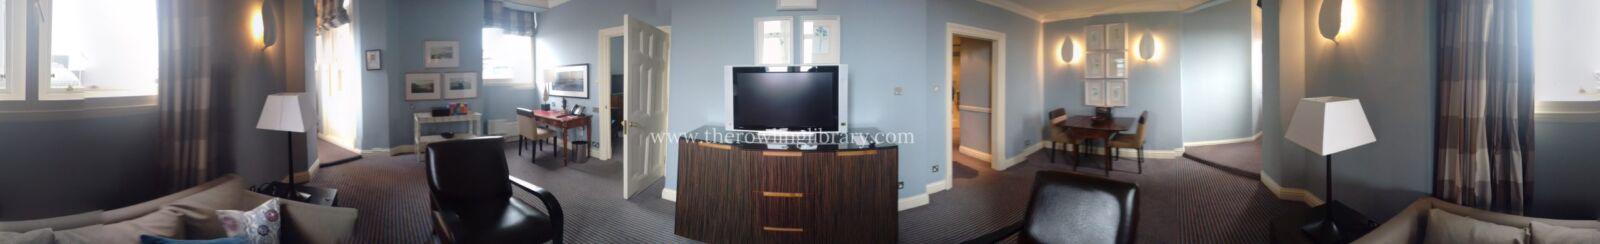
In order to click on desk chair in this screenshot , I will do `click(528, 138)`.